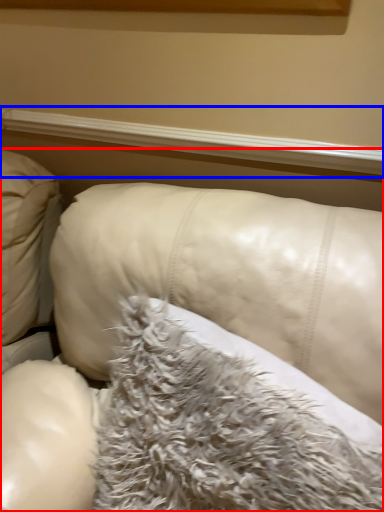
Question: Which of the following is the closest to the observer, furniture (highlighted by a red box) or window sill (highlighted by a blue box)?

Choices:
 (A) furniture
 (B) window sill

Answer: (A)